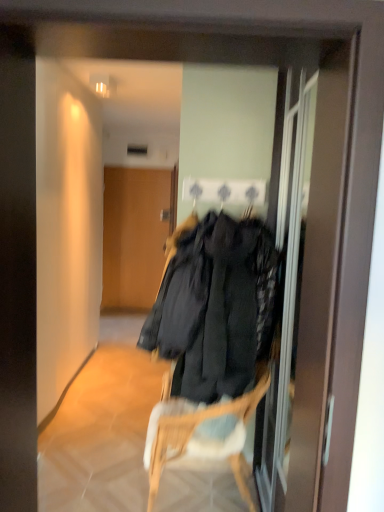
Question: Is wooden door at center facing away from transparent glass screen door at center?

Choices:
 (A) no
 (B) yes

Answer: (A)

Question: Considering the relative positions of wooden door at center and transparent glass screen door at center in the image provided, is wooden door at center behind transparent glass screen door at center?

Choices:
 (A) no
 (B) yes

Answer: (B)

Question: Considering the relative positions of wooden door at center and transparent glass screen door at center in the image provided, is wooden door at center to the right of transparent glass screen door at center from the viewer's perspective?

Choices:
 (A) yes
 (B) no

Answer: (B)

Question: Is wooden door at center bigger than transparent glass screen door at center?

Choices:
 (A) no
 (B) yes

Answer: (A)

Question: Can you confirm if wooden door at center is shorter than transparent glass screen door at center?

Choices:
 (A) yes
 (B) no

Answer: (A)

Question: Is transparent glass screen door at center in front of or behind wooden door at center in the image?

Choices:
 (A) behind
 (B) front

Answer: (B)

Question: Is transparent glass screen door at center taller or shorter than wooden door at center?

Choices:
 (A) tall
 (B) short

Answer: (A)

Question: Would you say transparent glass screen door at center is inside or outside wooden door at center?

Choices:
 (A) inside
 (B) outside

Answer: (B)

Question: From the image's perspective, relative to wooden door at center, is transparent glass screen door at center above or below?

Choices:
 (A) above
 (B) below

Answer: (B)

Question: From their relative heights in the image, would you say wooden door at center is taller or shorter than woven wood chair at center?

Choices:
 (A) tall
 (B) short

Answer: (A)

Question: Would you say wooden door at center is to the left or to the right of woven wood chair at center in the picture?

Choices:
 (A) right
 (B) left

Answer: (B)

Question: Looking at their shapes, would you say wooden door at center is wider or thinner than woven wood chair at center?

Choices:
 (A) thin
 (B) wide

Answer: (A)

Question: Considering the positions of point (107, 245) and point (155, 481), is point (107, 245) closer or farther from the camera than point (155, 481)?

Choices:
 (A) closer
 (B) farther

Answer: (B)

Question: From the image's perspective, relative to transparent glass screen door at center, is woven wood chair at center above or below?

Choices:
 (A) below
 (B) above

Answer: (A)

Question: Relative to transparent glass screen door at center, is woven wood chair at center in front or behind?

Choices:
 (A) front
 (B) behind

Answer: (B)